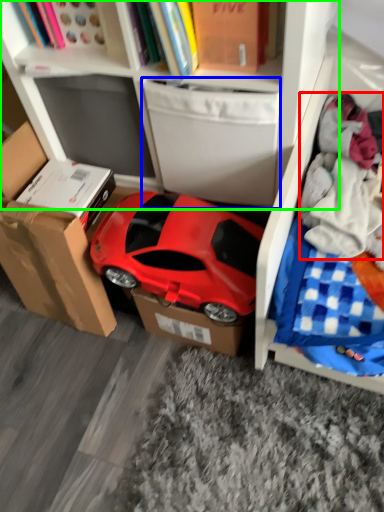
Question: Considering the real-world distances, which object is farthest from clothing (highlighted by a red box)? drawer (highlighted by a blue box) or bookcase (highlighted by a green box)?

Choices:
 (A) drawer
 (B) bookcase

Answer: (B)